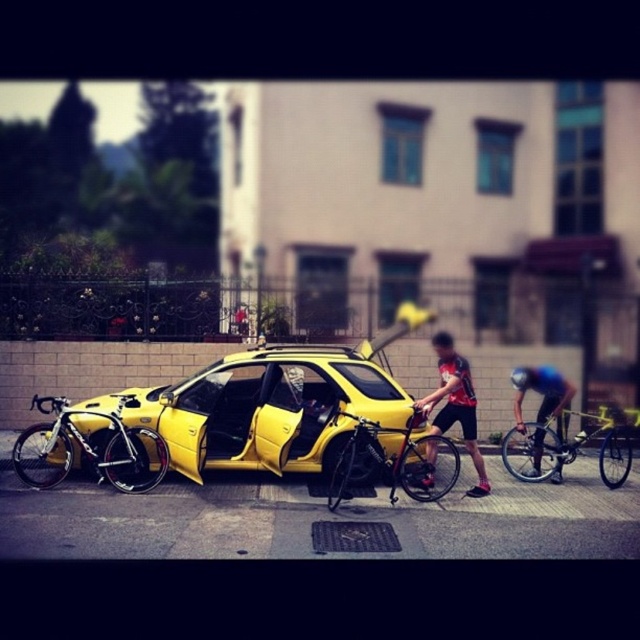
Question: Observing the image, what is the correct spatial positioning of yellow matte bicycle at center in reference to black matte bicycle helmet at center?

Choices:
 (A) right
 (B) left

Answer: (A)

Question: Which object is positioned closest to the black matte bicycle helmet at center?

Choices:
 (A) yellow matte bicycle at center
 (B) reddish-black jersey at center
 (C) shiny black bicycle at center

Answer: (A)

Question: Which object appears farthest from the camera in this image?

Choices:
 (A) shiny silver bicycle at left
 (B) black matte bicycle helmet at center
 (C) shiny black bicycle at center
 (D) yellow matte bicycle at center

Answer: (B)

Question: Is shiny silver bicycle at left thinner than yellow matte bicycle at center?

Choices:
 (A) no
 (B) yes

Answer: (A)

Question: Where is shiny silver bicycle at left located in relation to reddish-black jersey at center in the image?

Choices:
 (A) left
 (B) right

Answer: (A)

Question: Estimate the real-world distances between objects in this image. Which object is farther from the black matte bicycle helmet at center?

Choices:
 (A) reddish-black jersey at center
 (B) blue fabric shirt at center
 (C) yellow matte bicycle at center

Answer: (A)